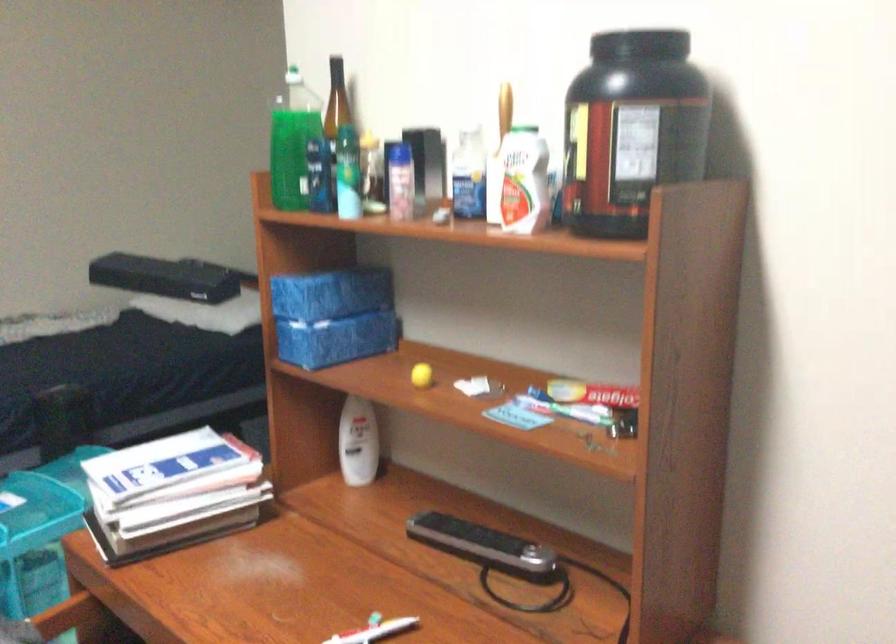
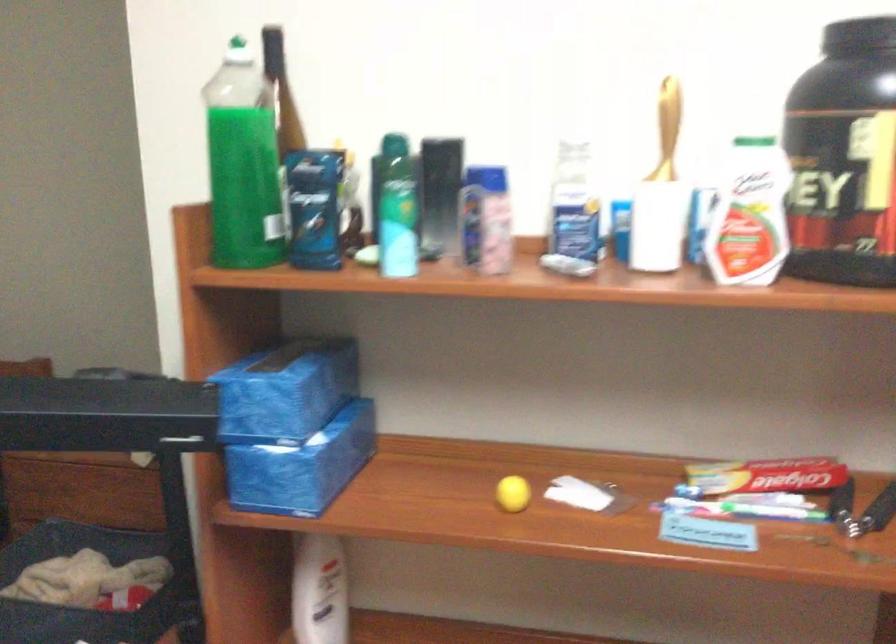
The point at (x=567, y=412) is marked in the first image. Where is the corresponding point in the second image?

(743, 509)